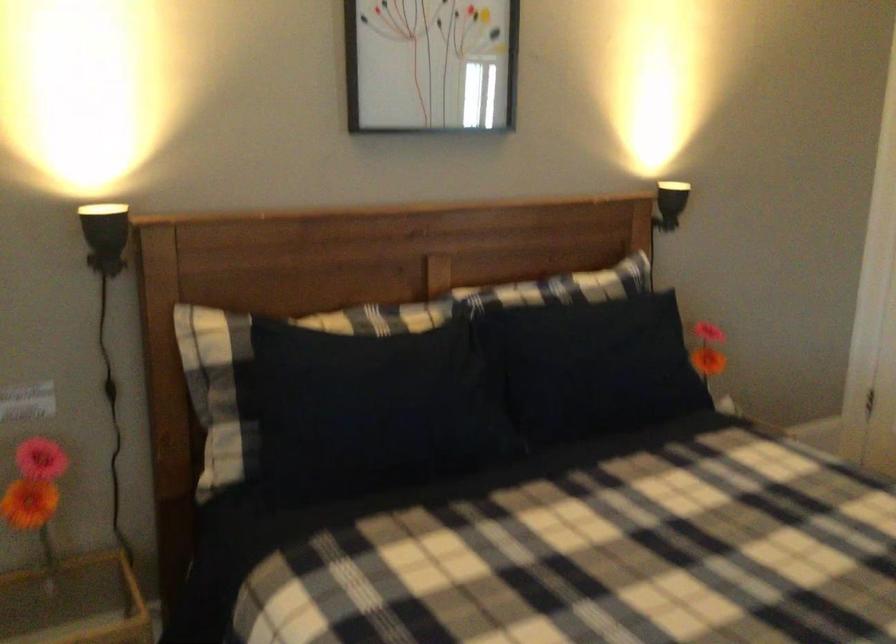
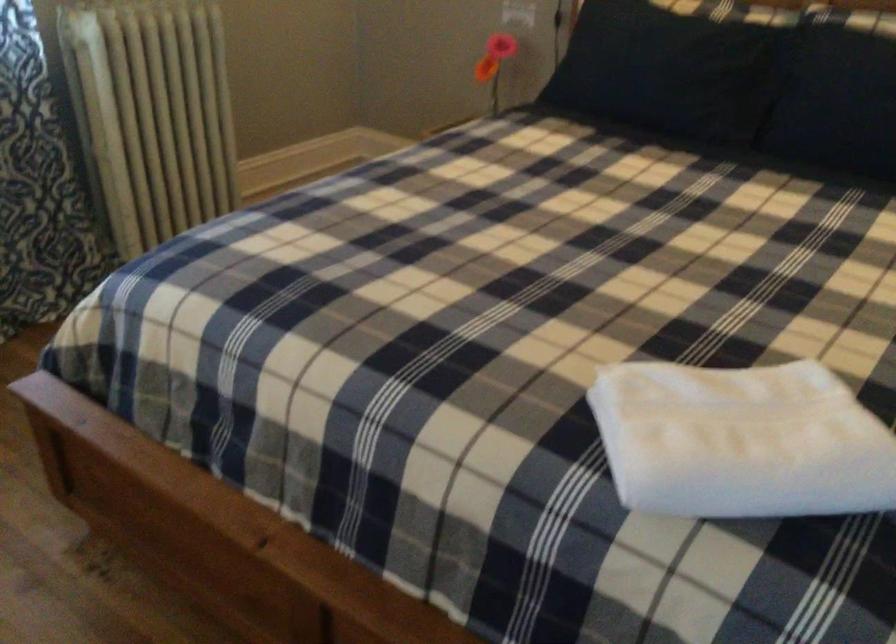
Find the pixel in the second image that matches the point at 607,377 in the first image.

(839, 104)